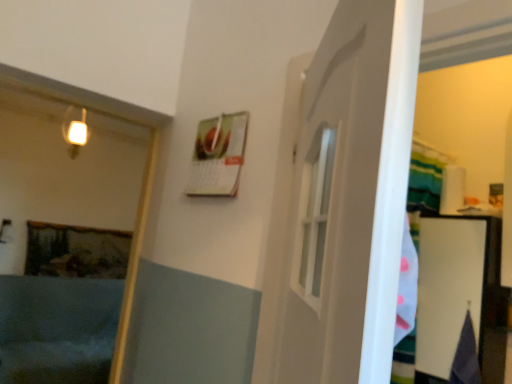
This screenshot has width=512, height=384. What do you see at coordinates (57, 329) in the screenshot?
I see `matte blue bathtub at lower left` at bounding box center [57, 329].

Identify the location of matte blue bathtub at lower left. (57, 329).

What do you see at coordinates (74, 131) in the screenshot? I see `matte white light fixture at upper left` at bounding box center [74, 131].

Where is `matte white light fixture at upper left`? Image resolution: width=512 pixels, height=384 pixels. matte white light fixture at upper left is located at coordinates (74, 131).

Where is `matte blue bathtub at lower left`? The width and height of the screenshot is (512, 384). matte blue bathtub at lower left is located at coordinates (57, 329).

Considering the relative positions of matte blue bathtub at lower left and matte white light fixture at upper left in the image provided, is matte blue bathtub at lower left to the right of matte white light fixture at upper left from the viewer's perspective?

In fact, matte blue bathtub at lower left is to the left of matte white light fixture at upper left.

Which object is closer to the camera taking this photo, matte blue bathtub at lower left or matte white light fixture at upper left?

matte blue bathtub at lower left is in front.

Is point (62, 300) closer or farther from the camera than point (70, 116)?

Point (62, 300) appears to be farther away from the viewer than point (70, 116).

From the image's perspective, which is below, matte blue bathtub at lower left or matte white light fixture at upper left?

From the image's view, matte blue bathtub at lower left is below.

From a real-world perspective, which object stands above the other?

matte white light fixture at upper left, from a real-world perspective.

Which object is thinner, matte blue bathtub at lower left or matte white light fixture at upper left?

With smaller width is matte white light fixture at upper left.

In terms of height, does matte blue bathtub at lower left look taller or shorter compared to matte white light fixture at upper left?

In the image, matte blue bathtub at lower left appears to be taller than matte white light fixture at upper left.

Between matte blue bathtub at lower left and matte white light fixture at upper left, which one has larger size?

matte blue bathtub at lower left.

Can matte white light fixture at upper left be found inside matte blue bathtub at lower left?

No, matte blue bathtub at lower left does not contain matte white light fixture at upper left.

Would you consider matte blue bathtub at lower left to be distant from matte white light fixture at upper left?

Yes, matte blue bathtub at lower left is far from matte white light fixture at upper left.

Is matte white light fixture at upper left at the back of matte blue bathtub at lower left?

No, matte blue bathtub at lower left's orientation is not away from matte white light fixture at upper left.

What's the angular difference between matte blue bathtub at lower left and matte white light fixture at upper left's facing directions?

0.338 degrees.

In order to click on light fixture on the right of matte blue bathtub at lower left in this screenshot , I will do `click(74, 131)`.

Can you confirm if matte white light fixture at upper left is positioned to the right of matte blue bathtub at lower left?

Yes, matte white light fixture at upper left is to the right of matte blue bathtub at lower left.

Does matte white light fixture at upper left lie behind matte blue bathtub at lower left?

Yes, it is.

Which is closer, (80, 137) or (26, 288)?

Clearly, point (80, 137) is closer to the camera than point (26, 288).

From the image's perspective, is matte white light fixture at upper left on matte blue bathtub at lower left?

Indeed, from the image's perspective, matte white light fixture at upper left is shown above matte blue bathtub at lower left.

From a real-world perspective, which object stands above the other?

matte white light fixture at upper left is physically above.

Which object is thinner, matte white light fixture at upper left or matte blue bathtub at lower left?

Thinner between the two is matte white light fixture at upper left.

From the picture: Does matte white light fixture at upper left have a greater height compared to matte blue bathtub at lower left?

No, matte white light fixture at upper left is not taller than matte blue bathtub at lower left.

Considering the sizes of objects matte white light fixture at upper left and matte blue bathtub at lower left in the image provided, who is bigger, matte white light fixture at upper left or matte blue bathtub at lower left?

With larger size is matte blue bathtub at lower left.

Do you think matte white light fixture at upper left is within matte blue bathtub at lower left, or outside of it?

matte white light fixture at upper left is outside matte blue bathtub at lower left.

Is the surface of matte white light fixture at upper left in direct contact with matte blue bathtub at lower left?

matte white light fixture at upper left and matte blue bathtub at lower left are not in contact.

Could you tell me if matte white light fixture at upper left is facing matte blue bathtub at lower left?

No, matte white light fixture at upper left is not facing towards matte blue bathtub at lower left.

How far apart are matte white light fixture at upper left and matte blue bathtub at lower left?

4.81 feet.

In order to click on light fixture lying above the matte blue bathtub at lower left (from the image's perspective) in this screenshot , I will do `click(74, 131)`.

Locate an element on the screen. The width and height of the screenshot is (512, 384). light fixture that appears behind the matte blue bathtub at lower left is located at coordinates (74, 131).

At what (x,y) coordinates should I click in order to perform the action: click on light fixture positioned vertically above the matte blue bathtub at lower left (from a real-world perspective). Please return your answer as a coordinate pair (x, y). This screenshot has width=512, height=384. Looking at the image, I should click on (74, 131).